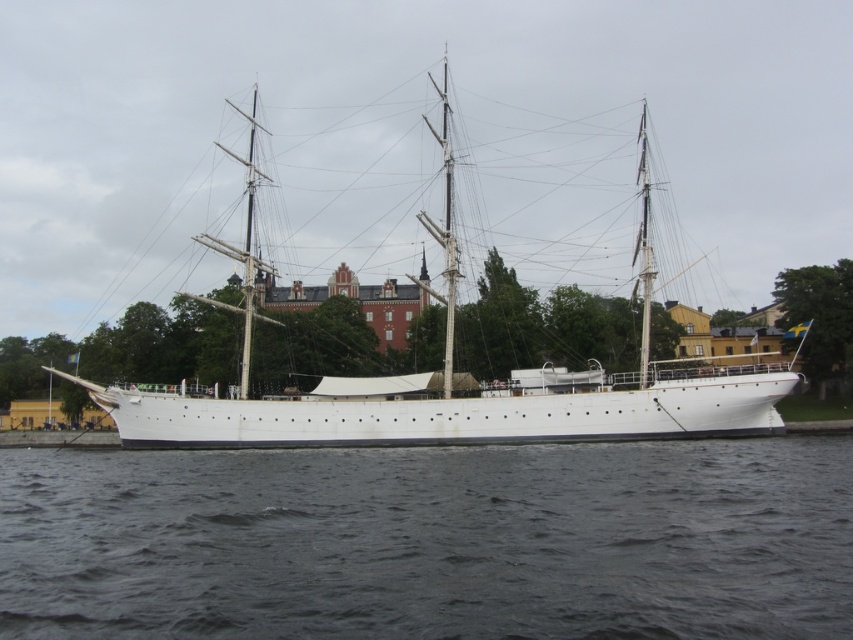
Question: Can you confirm if dark gray water at lower center is positioned below white matte sailboat at center?

Choices:
 (A) yes
 (B) no

Answer: (A)

Question: Among these objects, which one is nearest to the camera?

Choices:
 (A) dark gray water at lower center
 (B) white matte sailboat at center

Answer: (A)

Question: Is dark gray water at lower center below white matte sailboat at center?

Choices:
 (A) no
 (B) yes

Answer: (B)

Question: Does dark gray water at lower center come behind white matte sailboat at center?

Choices:
 (A) no
 (B) yes

Answer: (A)